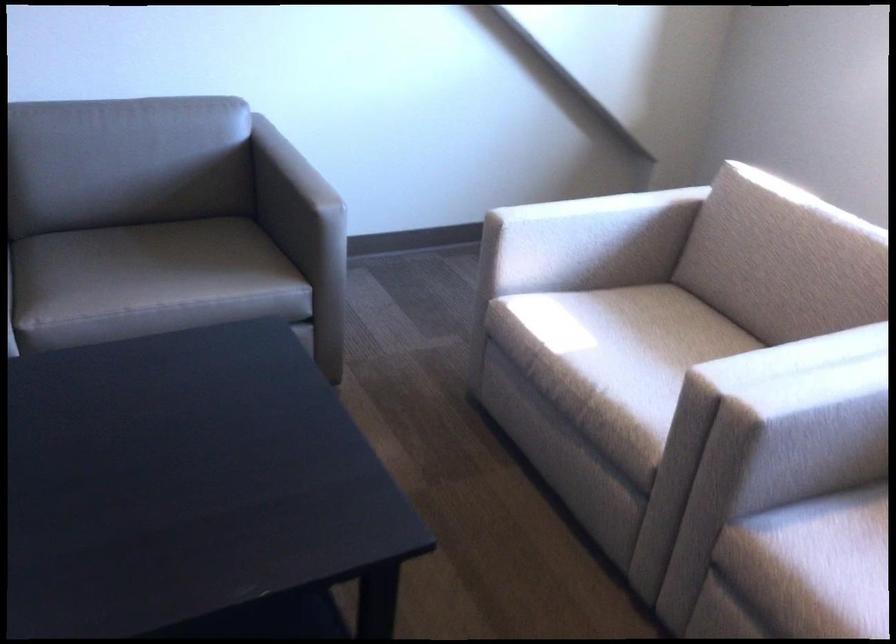
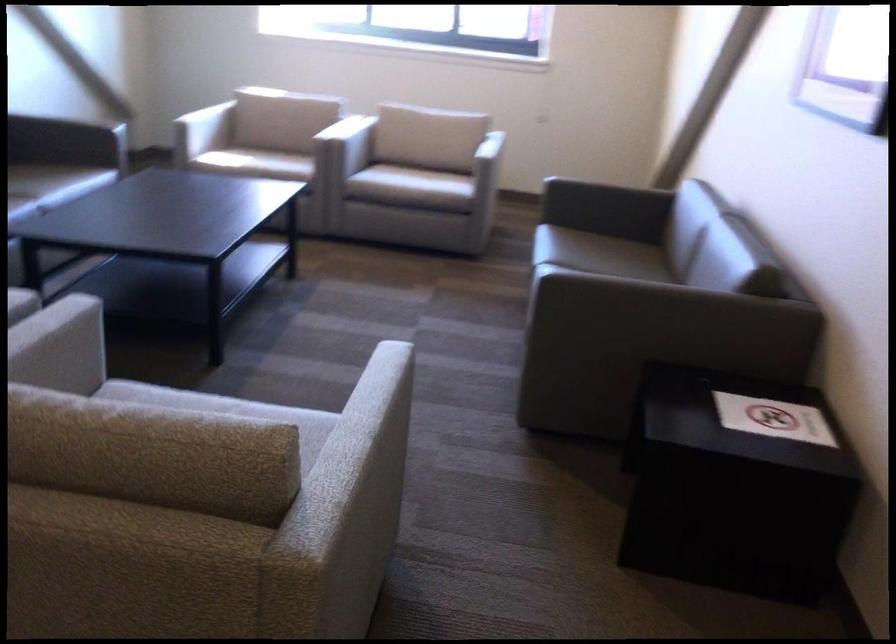
The point at (567, 399) is marked in the first image. Where is the corresponding point in the second image?

(255, 163)